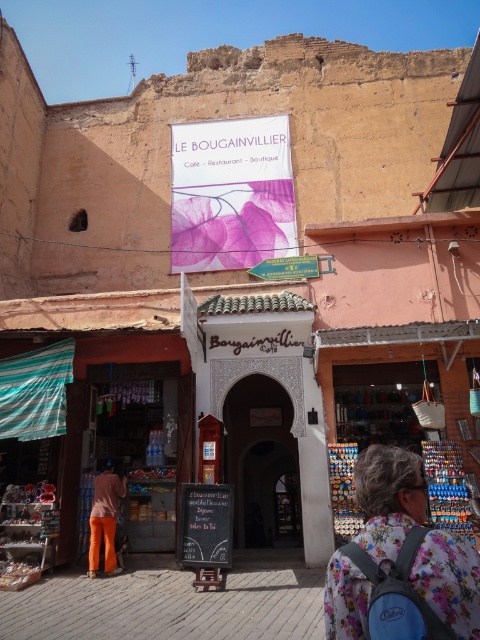
Question: Which of the following is the farthest from the observer?

Choices:
 (A) (189, 138)
 (B) (96, 502)
 (C) (216, 540)
 (D) (457, 564)

Answer: (A)

Question: Can you confirm if floral fabric backpack at lower right is wider than orange fabric pants at lower left?

Choices:
 (A) no
 (B) yes

Answer: (B)

Question: Does pink paper sign at upper center have a lesser width compared to floral fabric backpack at lower right?

Choices:
 (A) yes
 (B) no

Answer: (B)

Question: Among these objects, which one is farthest from the camera?

Choices:
 (A) pink paper sign at upper center
 (B) black chalkboard sign at center

Answer: (A)

Question: Is floral fabric backpack at lower right thinner than black chalkboard sign at center?

Choices:
 (A) no
 (B) yes

Answer: (A)

Question: Which of the following is the closest to the observer?

Choices:
 (A) black chalkboard sign at center
 (B) floral fabric backpack at lower right

Answer: (B)